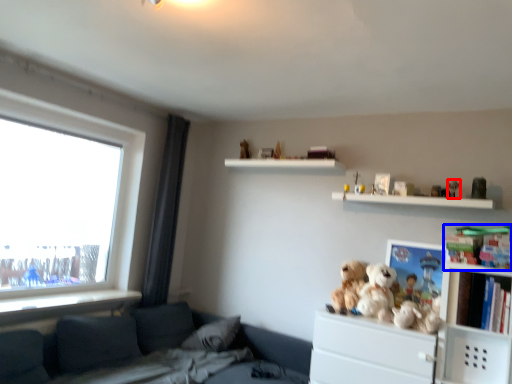
Question: Which object is closer to the camera taking this photo, toy (highlighted by a red box) or toy (highlighted by a blue box)?

Choices:
 (A) toy
 (B) toy

Answer: (B)